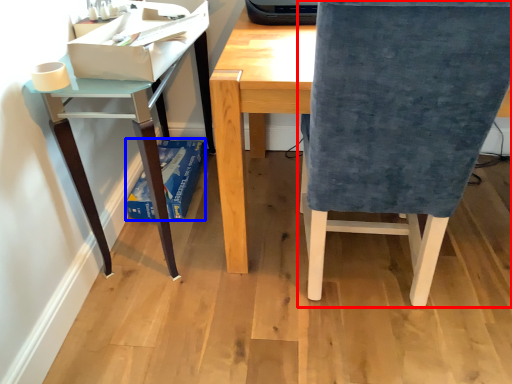
Question: Which of the following is the closest to the observer, chair (highlighted by a red box) or paperback book (highlighted by a blue box)?

Choices:
 (A) chair
 (B) paperback book

Answer: (A)